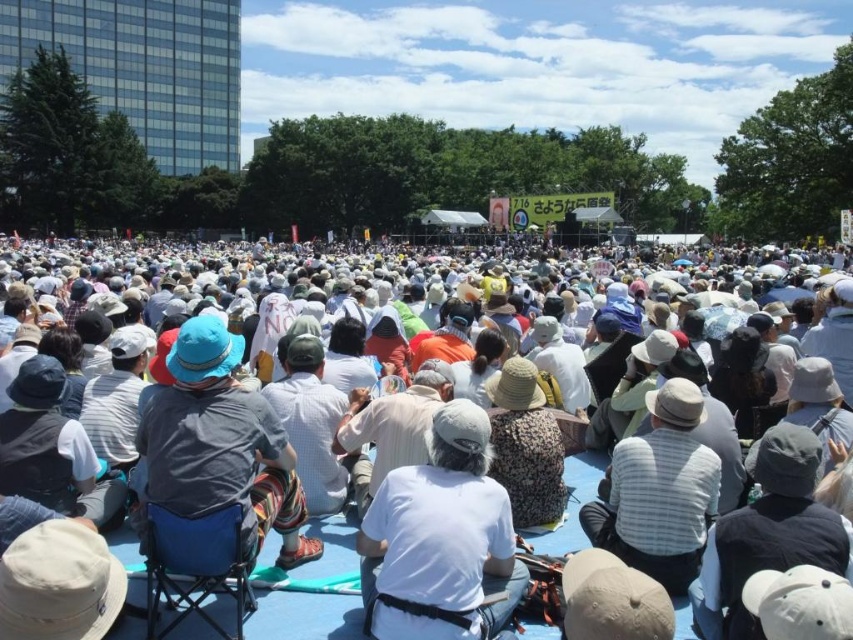
You are organizing a picnic and need to decide which item to place first. The white fabric at center and the blue fabric chair at center are both in your inventory. Which item should you place first to ensure there is enough space for both?

You should place the blue fabric chair at center first because the white fabric at center is smaller and can be placed around it without space issues.

Consider the image. You are standing at the edge of the scene and want to move towards the blue fabric chair at center. Which direction should you go to avoid the white fabric crowd at center?

The white fabric crowd at center is to the right of the blue fabric chair at center, so you should move to the left to avoid them.

You are a photographer trying to capture a group photo of the white fabric crowd at center and the striped fabric hat at center. Which object in the scene is larger in size?

The white fabric crowd at center is bigger than the striped fabric hat at center.